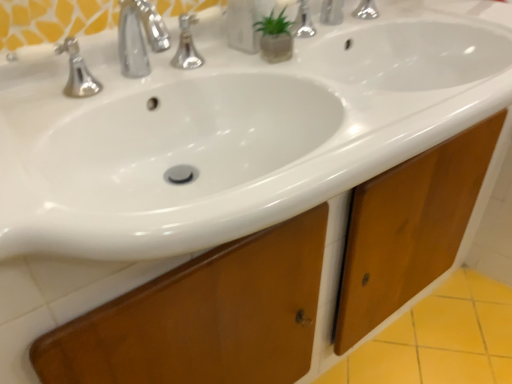
Question: Would you say transparent plastic soap dispenser at upper center is to the left or to the right of white glossy sink at center in the picture?

Choices:
 (A) left
 (B) right

Answer: (A)

Question: Considering the positions of transparent plastic soap dispenser at upper center and white glossy sink at center in the image, is transparent plastic soap dispenser at upper center wider or thinner than white glossy sink at center?

Choices:
 (A) thin
 (B) wide

Answer: (A)

Question: From a real-world perspective, is transparent plastic soap dispenser at upper center physically located above or below white glossy sink at center?

Choices:
 (A) above
 (B) below

Answer: (A)

Question: Visually, is white glossy sink at center positioned to the left or to the right of transparent plastic soap dispenser at upper center?

Choices:
 (A) right
 (B) left

Answer: (A)

Question: Considering the positions of white glossy sink at center and transparent plastic soap dispenser at upper center in the image, is white glossy sink at center bigger or smaller than transparent plastic soap dispenser at upper center?

Choices:
 (A) big
 (B) small

Answer: (A)

Question: Is white glossy sink at center in front of or behind transparent plastic soap dispenser at upper center in the image?

Choices:
 (A) behind
 (B) front

Answer: (B)

Question: Is white glossy sink at center wider or thinner than transparent plastic soap dispenser at upper center?

Choices:
 (A) wide
 (B) thin

Answer: (A)